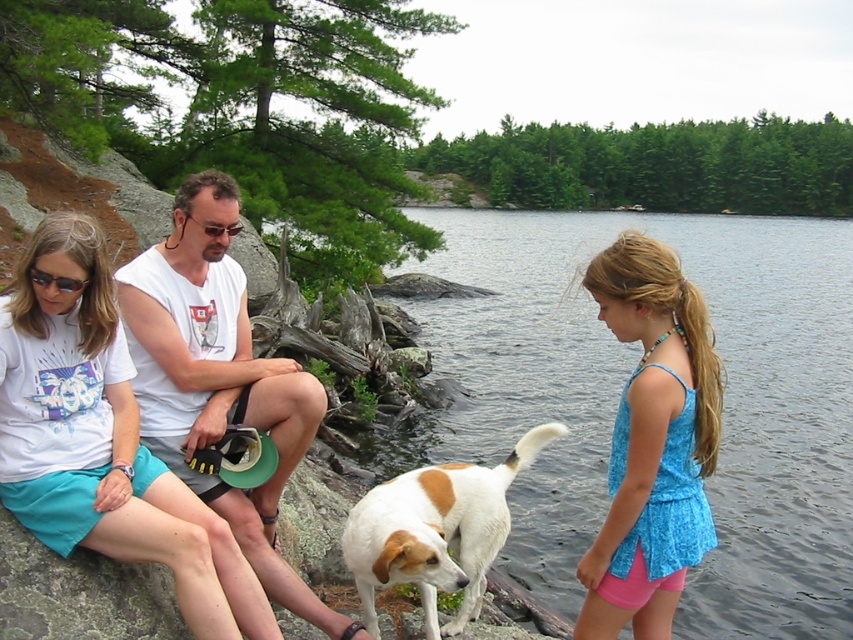
You are standing at the center of the image and want to locate the clear water at lower right. Which direction should you move to reach it?

To reach the clear water at lower right, you should move towards the lower right direction since its position is at point (619, 392).

From the picture: You are a photographer planning to take a picture of the clear water at lower right and the white fur dog at center. Based on their positions, which object should you focus on first to ensure both are in the frame?

The white fur dog at center should be focused on first because the clear water at lower right is positioned over it, meaning the dog is closer to the camera and adjusting focus to the dog will naturally include the water in the background.